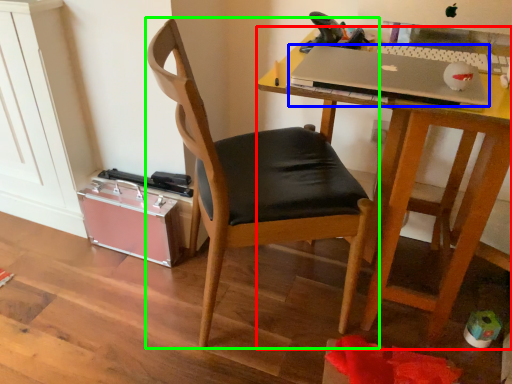
Question: Which object is positioned closest to desk (highlighted by a red box)? Select from laptop (highlighted by a blue box) and chair (highlighted by a green box).

Choices:
 (A) laptop
 (B) chair

Answer: (A)